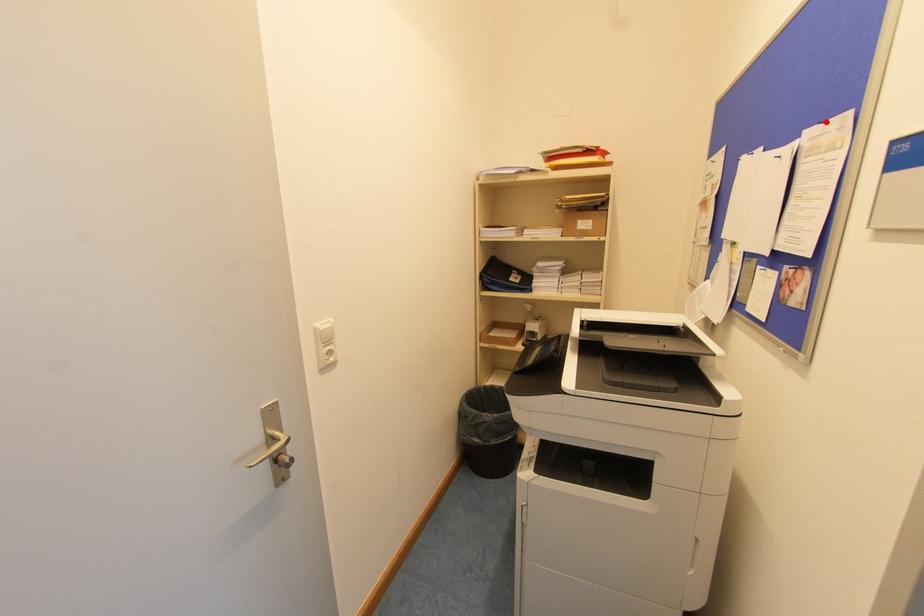
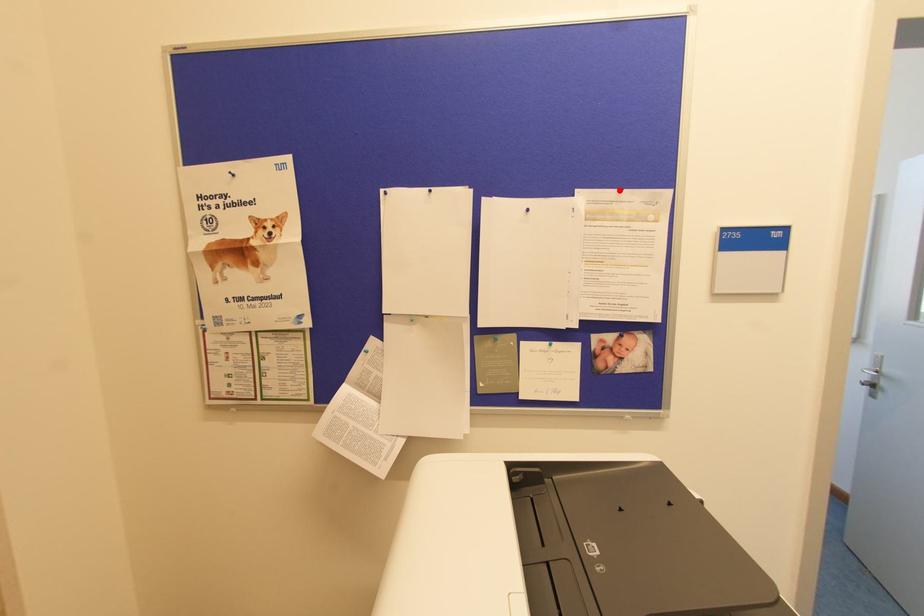
I am providing you with two images of the same scene from different viewpoints. A red point is marked on the first image and another point is marked on the second image. Are the points marked in image1 and image2 representing the same 3D position?

Yes